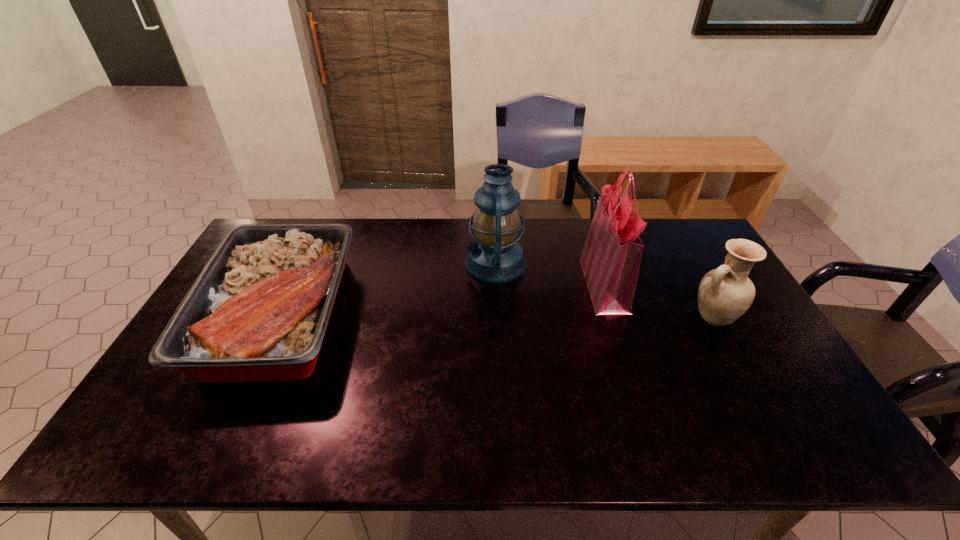
Locate an element on the screen. This screenshot has width=960, height=540. vacant space located on the left of the rightmost object is located at coordinates (579, 316).

The height and width of the screenshot is (540, 960). What are the coordinates of `blank space located 0.210m on the right of the tray` in the screenshot? It's located at (421, 314).

The width and height of the screenshot is (960, 540). Find the location of `shopping bag present at the far edge`. shopping bag present at the far edge is located at coordinates (611, 257).

Find the location of `lantern that is at the far edge`. lantern that is at the far edge is located at coordinates (495, 257).

Identify the location of tray at the far edge. This screenshot has width=960, height=540. (258, 311).

I want to click on object located at the left edge, so click(x=258, y=311).

Where is `object at the right edge`? object at the right edge is located at coordinates (724, 294).

The height and width of the screenshot is (540, 960). I want to click on object that is at the far left corner, so click(x=258, y=311).

Locate an element on the screen. This screenshot has height=540, width=960. vacant space at the far edge of the desktop is located at coordinates (352, 225).

At what (x,y) coordinates should I click in order to perform the action: click on vacant area at the right edge. Please return your answer as a coordinate pair (x, y). This screenshot has width=960, height=540. Looking at the image, I should click on (800, 393).